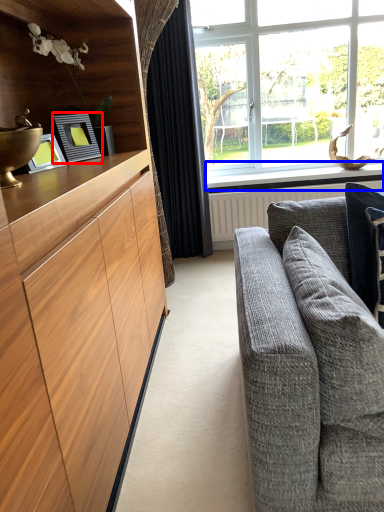
Question: Among these objects, which one is nearest to the camera, picture frame (highlighted by a red box) or window sill (highlighted by a blue box)?

Choices:
 (A) picture frame
 (B) window sill

Answer: (A)